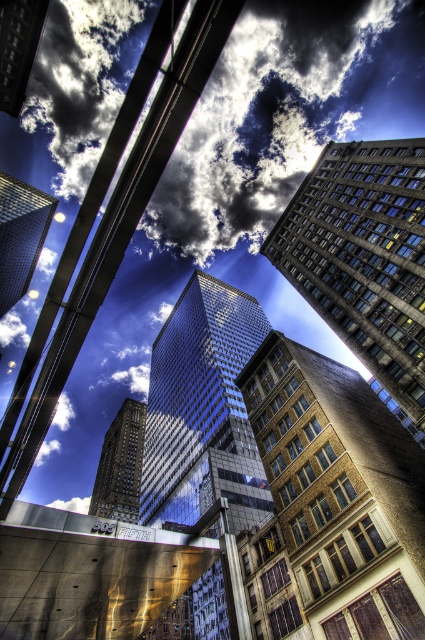
Can you confirm if glossy glass skyscraper at center is bigger than shiny glass skyscraper at upper left?

Indeed, glossy glass skyscraper at center has a larger size compared to shiny glass skyscraper at upper left.

Is glossy glass skyscraper at center further to the viewer compared to shiny glass skyscraper at upper left?

No, glossy glass skyscraper at center is in front of shiny glass skyscraper at upper left.

Is point (180, 388) positioned after point (20, 90)?

Yes, it is behind point (20, 90).

This screenshot has width=425, height=640. Find the location of `glossy glass skyscraper at center`. glossy glass skyscraper at center is located at coordinates (201, 404).

Who is more forward, (54, 198) or (127, 461)?

Point (127, 461)

Is point (22, 278) positioned in front of point (130, 442)?

That is False.

Who is more distant from viewer, (0,308) or (138,458)?

The point (138,458) is behind.

This screenshot has height=640, width=425. Identify the location of shiny glass skyscraper at left. (20, 236).

Between shiny glass skyscraper at left and shiny glass skyscraper at upper left, which one appears on the left side from the viewer's perspective?

Positioned to the left is shiny glass skyscraper at left.

Describe the element at coordinates (20, 236) in the screenshot. The width and height of the screenshot is (425, 640). I see `shiny glass skyscraper at left` at that location.

At what (x,y) coordinates should I click in order to perform the action: click on shiny glass skyscraper at left. Please return your answer as a coordinate pair (x, y). The height and width of the screenshot is (640, 425). Looking at the image, I should click on (20, 236).